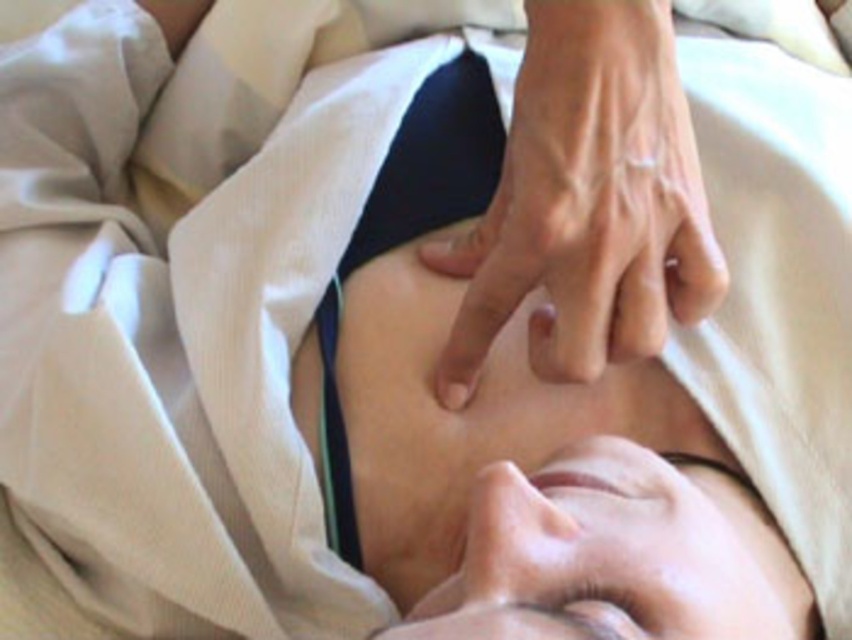
Where is the smooth skin hand at center located in the image?

The smooth skin hand at center is located at point [586,202] in the image.

You are a therapist observing the scene. You need to adjust the position of the smooth skin hand at center so that it is no longer covering the brown matte eye at upper center. Which direction should you move the hand?

The brown matte eye at upper center is behind the smooth skin hand at center, so to uncover it, move the hand downward.

You are a therapist trying to locate two specific points on a client during a facial massage. The first point is at coordinate point [609,273] and the second is at point [654,628]. From the client perspective, which point is closer to their face?

Point [609,273] is behind point [654,628], so from the client perspective, point [654,628] is closer to their face.